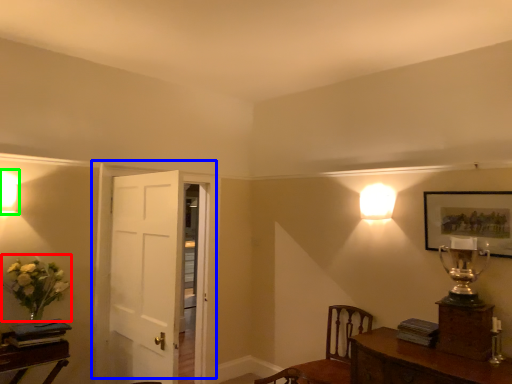
Question: Which object is positioned closest to floral arrangement (highlighted by a red box)? Select from door (highlighted by a blue box) and lamp (highlighted by a green box).

Choices:
 (A) door
 (B) lamp

Answer: (B)